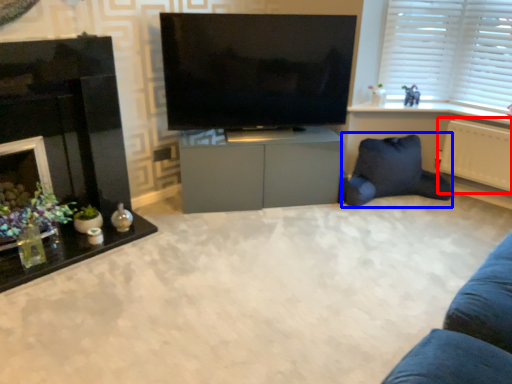
Question: Among these objects, which one is nearest to the camera, radiator (highlighted by a red box) or bean bag chair (highlighted by a blue box)?

Choices:
 (A) radiator
 (B) bean bag chair

Answer: (A)